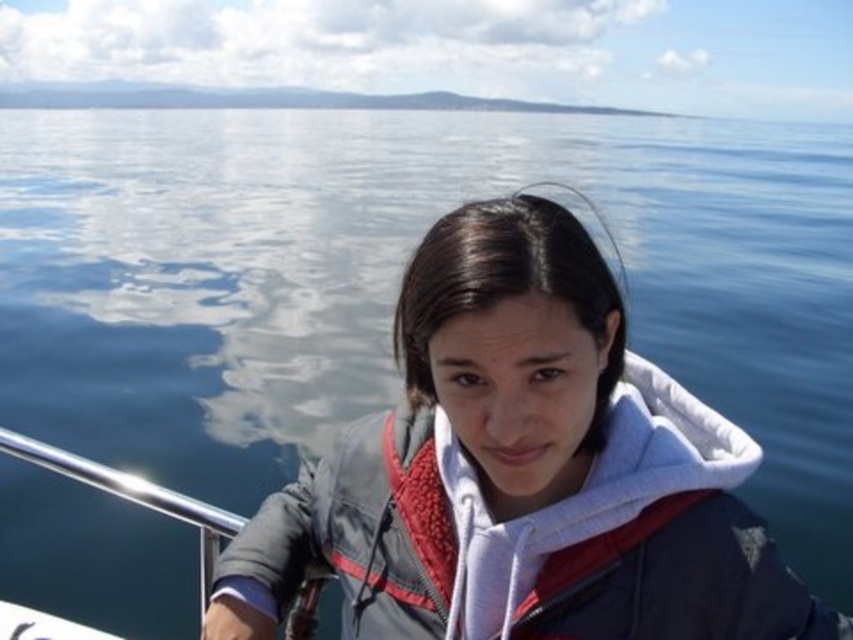
You are a photographer trying to capture a photo of the white fleece jacket at center and the polished metal rail at lower left. Which object should you focus on first if you want to ensure both are in focus without adjusting your camera settings?

The white fleece jacket at center is taller than the polished metal rail at lower left, so focusing on the white fleece jacket at center first will help ensure both are in focus since it is larger and closer to the camera.

You are a photographer trying to capture the person in the white fleece jacket at center and the polished metal rail at lower left. Which object is located to the right side of the other?

The white fleece jacket at center is positioned on the right side of the polished metal rail at lower left.